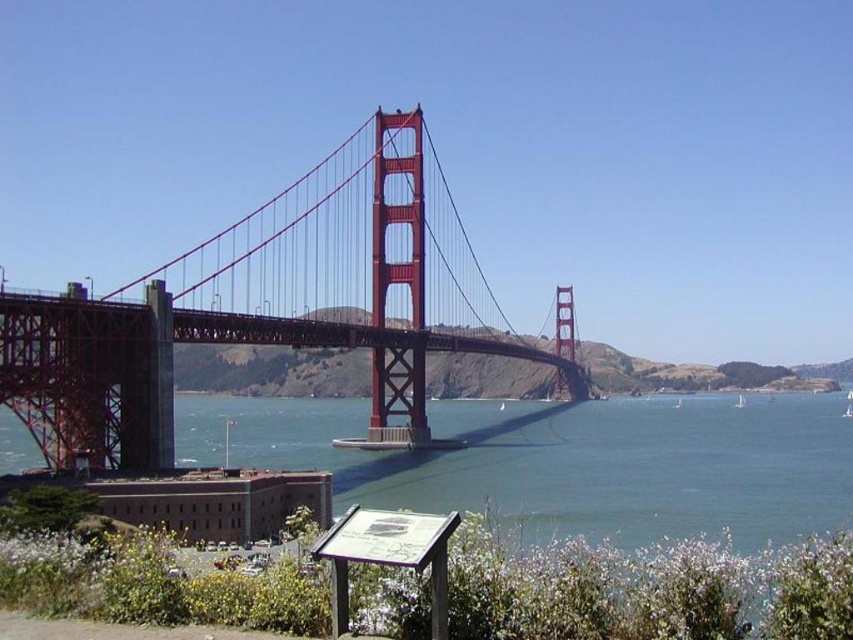
Who is taller, painted steel bridge at center or blue water at center?

painted steel bridge at center

This screenshot has width=853, height=640. Identify the location of painted steel bridge at center. (267, 308).

Locate an element on the screen. Image resolution: width=853 pixels, height=640 pixels. painted steel bridge at center is located at coordinates (267, 308).

The image size is (853, 640). Identify the location of painted steel bridge at center. (267, 308).